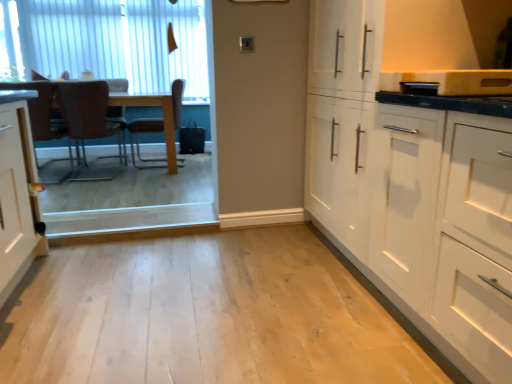
Question: Do you think brown leather chair at left, the 2th chair viewed from the left, is within brown fabric armchair at left, or outside of it?

Choices:
 (A) inside
 (B) outside

Answer: (B)

Question: Is brown leather chair at left, the 2th chair viewed from the left, wider or thinner than brown fabric armchair at left?

Choices:
 (A) thin
 (B) wide

Answer: (B)

Question: Estimate the real-world distances between objects in this image. Which object is farther from the white matte cabinet at right?

Choices:
 (A) white vertical blinds at upper left
 (B) brown leather chair at center, the first chair viewed from the right
 (C) brown leather chair at left, which is counted as the second chair, starting from the right
 (D) brown fabric armchair at left
 (E) light wood floor at center

Answer: (A)

Question: Estimate the real-world distances between objects in this image. Which object is farther from the brown leather chair at center, placed as the 3th chair when sorted from left to right?

Choices:
 (A) brown fabric armchair at left
 (B) white vertical blinds at upper left
 (C) light wood floor at center
 (D) brown leather chair at left, which is counted as the third chair, starting from the right
 (E) white matte cabinet at right

Answer: (E)